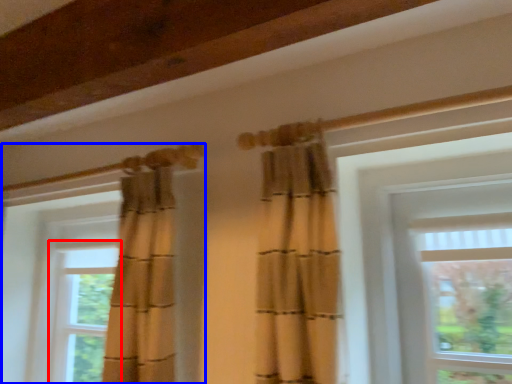
Question: Which of the following is the closest to the observer, window (highlighted by a red box) or window (highlighted by a blue box)?

Choices:
 (A) window
 (B) window

Answer: (B)